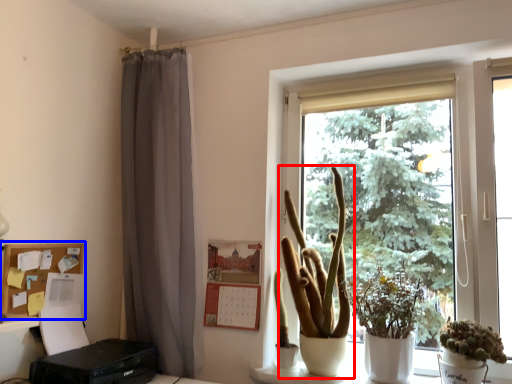
Question: Among these objects, which one is farthest to the camera, houseplant (highlighted by a red box) or shelf (highlighted by a blue box)?

Choices:
 (A) houseplant
 (B) shelf

Answer: (B)